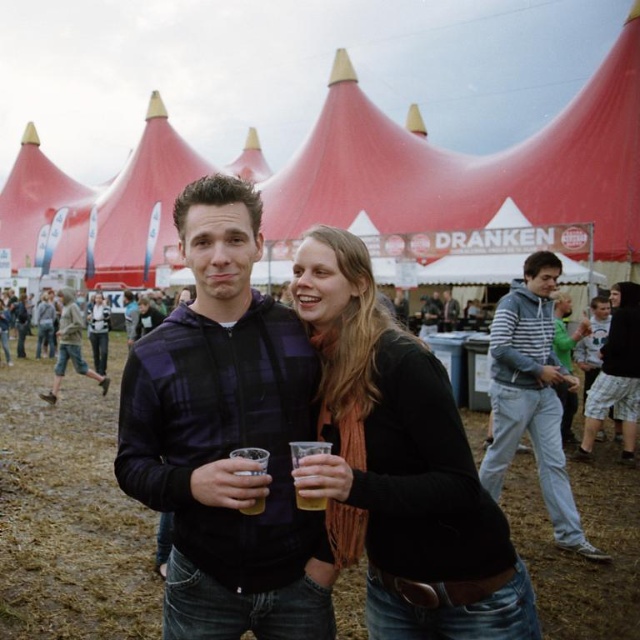
Is the position of brown muddy ground at center less distant than that of striped hoodie at right?

Yes.

Between brown muddy ground at center and striped hoodie at right, which one appears on the left side from the viewer's perspective?

Positioned to the left is brown muddy ground at center.

Who is more distant from viewer, (88,392) or (570,504)?

The point (88,392) is more distant.

Find the location of a particular element. The height and width of the screenshot is (640, 640). brown muddy ground at center is located at coordinates (68, 515).

Does point (273, 483) come closer to viewer compared to point (481, 497)?

No, it is behind (481, 497).

Is plaid fabric jacket at center taller than black matte scarf at center?

Indeed, plaid fabric jacket at center has a greater height compared to black matte scarf at center.

Is point (188, 307) farther from viewer compared to point (362, 412)?

That is True.

The height and width of the screenshot is (640, 640). What are the coordinates of `plaid fabric jacket at center` in the screenshot? It's located at (227, 436).

Which is more to the left, red fabric tent at center or brown muddy ground at center?

red fabric tent at center is more to the left.

The image size is (640, 640). Describe the element at coordinates (472, 166) in the screenshot. I see `red fabric tent at center` at that location.

Identify the location of red fabric tent at center. pos(472,166).